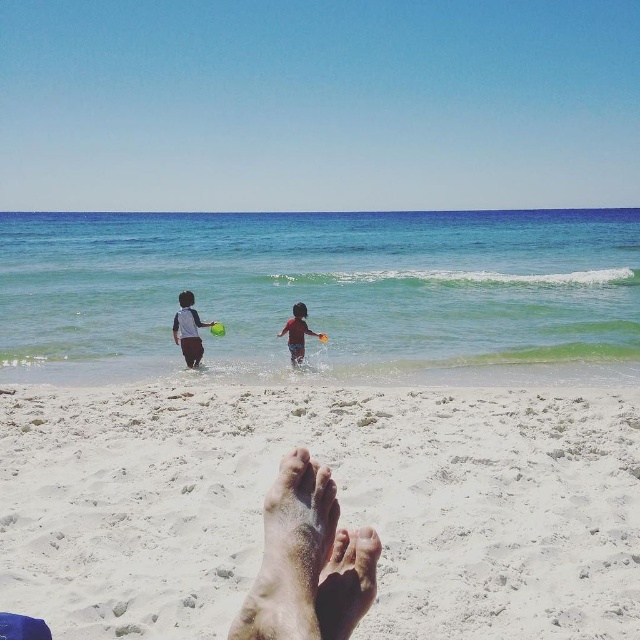
Is clear blue water at center to the left of red matte swimsuit at center from the viewer's perspective?

Incorrect, clear blue water at center is not on the left side of red matte swimsuit at center.

In the scene shown: Does clear blue water at center come in front of red matte swimsuit at center?

No, it is behind red matte swimsuit at center.

Image resolution: width=640 pixels, height=640 pixels. I want to click on clear blue water at center, so click(x=324, y=284).

This screenshot has height=640, width=640. I want to click on clear blue water at center, so click(x=324, y=284).

Is clear blue water at center to the left of dry skin foot at lower center from the viewer's perspective?

Indeed, clear blue water at center is positioned on the left side of dry skin foot at lower center.

Is clear blue water at center positioned before dry skin foot at lower center?

No.

Is point (48, 300) positioned after point (346, 564)?

Yes, it is.

Where is `clear blue water at center`? The height and width of the screenshot is (640, 640). clear blue water at center is located at coordinates (324, 284).

Which of these two, white sandy feet at lower center or dry skin foot at lower center, stands shorter?

With less height is white sandy feet at lower center.

Who is more distant from viewer, (113, 600) or (380, 541)?

Positioned behind is point (113, 600).

At what (x,y) coordinates should I click in order to perform the action: click on white sandy feet at lower center. Please return your answer as a coordinate pair (x, y). The image size is (640, 640). Looking at the image, I should click on (339, 500).

Find the location of a particular element. Image resolution: width=640 pixels, height=640 pixels. white sandy feet at lower center is located at coordinates (339, 500).